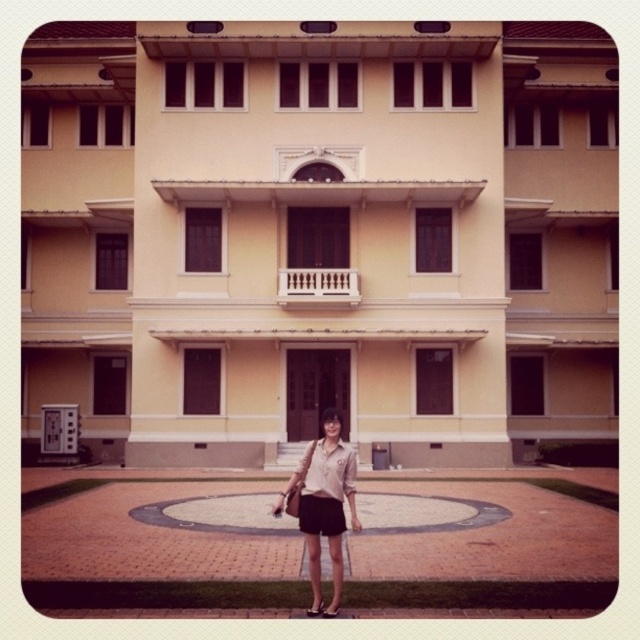
Question: In this image, where is matte beige blouse at center located relative to light beige fabric dress at center?

Choices:
 (A) below
 (B) above

Answer: (B)

Question: Which of the following is the farthest from the observer?

Choices:
 (A) (332, 458)
 (B) (312, 614)

Answer: (A)

Question: Can you confirm if matte beige blouse at center is positioned above light beige fabric dress at center?

Choices:
 (A) yes
 (B) no

Answer: (A)

Question: Does matte beige blouse at center lie behind light beige fabric dress at center?

Choices:
 (A) yes
 (B) no

Answer: (B)